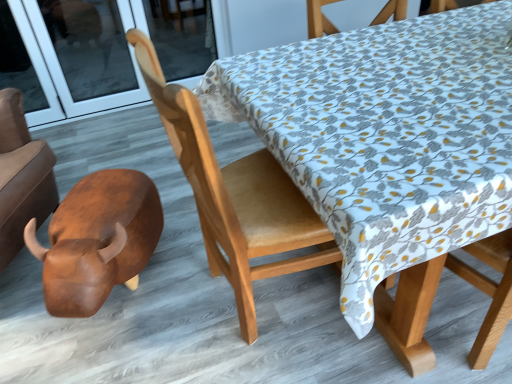
Question: Is light brown wood chair at center in front of or behind brown polished wood bull at lower left in the image?

Choices:
 (A) behind
 (B) front

Answer: (B)

Question: Considering the positions of light brown wood chair at center and brown polished wood bull at lower left in the image, is light brown wood chair at center taller or shorter than brown polished wood bull at lower left?

Choices:
 (A) tall
 (B) short

Answer: (A)

Question: Which of these objects is positioned closest to the light brown wood chair at center?

Choices:
 (A) brown polished wood bull at lower left
 (B) transparent glass door at upper left

Answer: (A)

Question: Based on their relative distances, which object is farther from the light brown wood chair at center?

Choices:
 (A) brown polished wood bull at lower left
 (B) transparent glass door at upper left

Answer: (B)